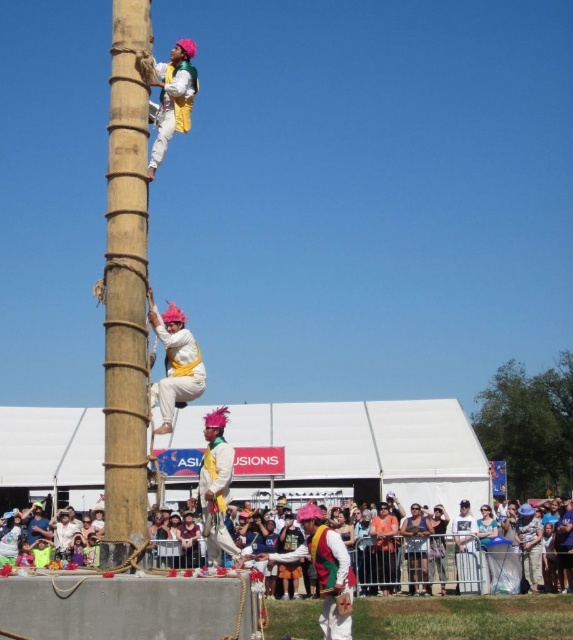
You are a participant in the climbing activity and need to choose between gripping the natural wood pole at center or the matte yellow fabric at upper center. Based on their sizes, which one is wider?

The natural wood pole at center is wider than the matte yellow fabric at upper center, so it is better to grip the natural wood pole at center.

You are a photographer at the event and want to capture a photo that includes both the multicolored fabric crowd at lower center and the matte yellow fabric at upper center. Based on their positions, which object should you focus on first to ensure both are in frame?

The multicolored fabric crowd at lower center is to the right of the matte yellow fabric at upper center. To ensure both are in frame, focus on the matte yellow fabric at upper center first as it is positioned higher up, allowing the photographer to adjust the camera angle downward to include the crowd on the right.

You are a photographer positioned at the back of the crowd, aiming to capture the climbers on the pole. You notice two points marked on your camera screen corresponding to the climbers at point (138, 516) and point (206, 433). Which point should you focus on to ensure the climber is closer to the camera?

Point (138, 516) is closer to the viewer than point (206, 433), so you should focus on point (138, 516) to capture the climber closer to the camera.